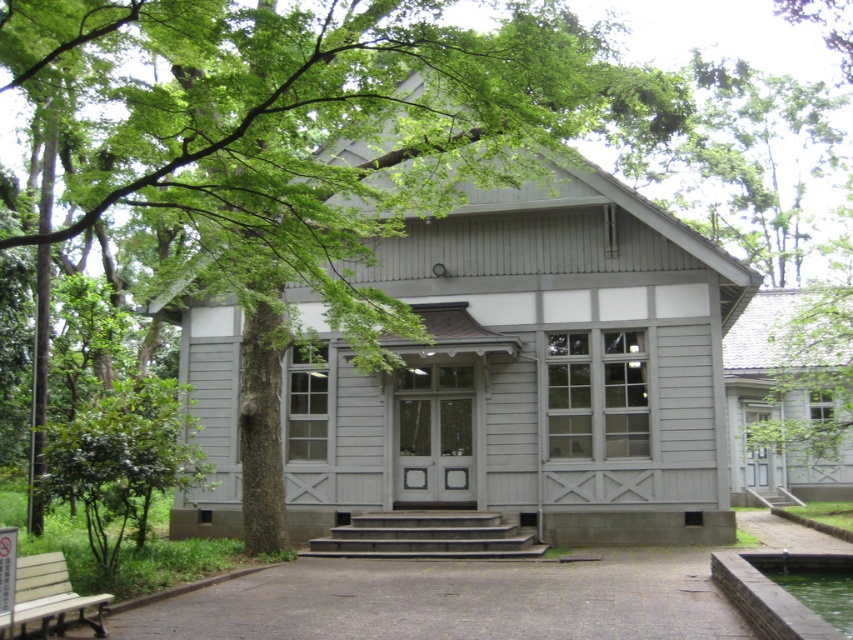
Question: Which of the following is the closest to the observer?

Choices:
 (A) wooden bench at lower left
 (B) green leafy tree at center

Answer: (A)

Question: Which point is farther to the camera?

Choices:
 (A) (490, 532)
 (B) (22, 620)

Answer: (A)

Question: Does green leafy tree at center appear over concrete steps at center?

Choices:
 (A) yes
 (B) no

Answer: (A)

Question: Is green leafy tree at center closer to the viewer compared to wooden bench at lower left?

Choices:
 (A) yes
 (B) no

Answer: (B)

Question: Is green leafy tree at center below wooden bench at lower left?

Choices:
 (A) yes
 (B) no

Answer: (B)

Question: Based on their relative distances, which object is farther from the green leafy tree at center?

Choices:
 (A) wooden bench at lower left
 (B) concrete steps at center

Answer: (A)